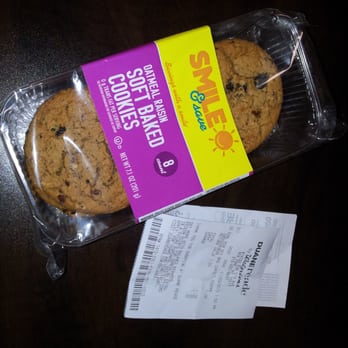
Identify the location of black table. (118, 41).